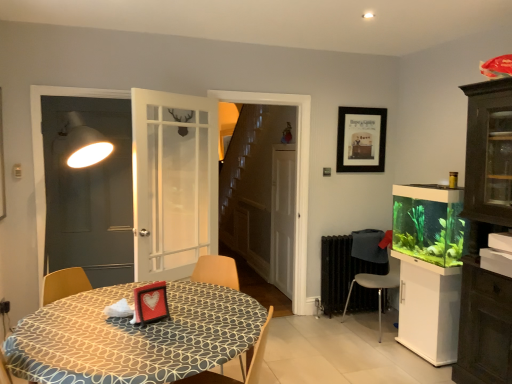
Locate an element on the screen. The image size is (512, 384). free space in front of metallic gray chair at lower right, arranged as the second chair when viewed from the left is located at coordinates (384, 348).